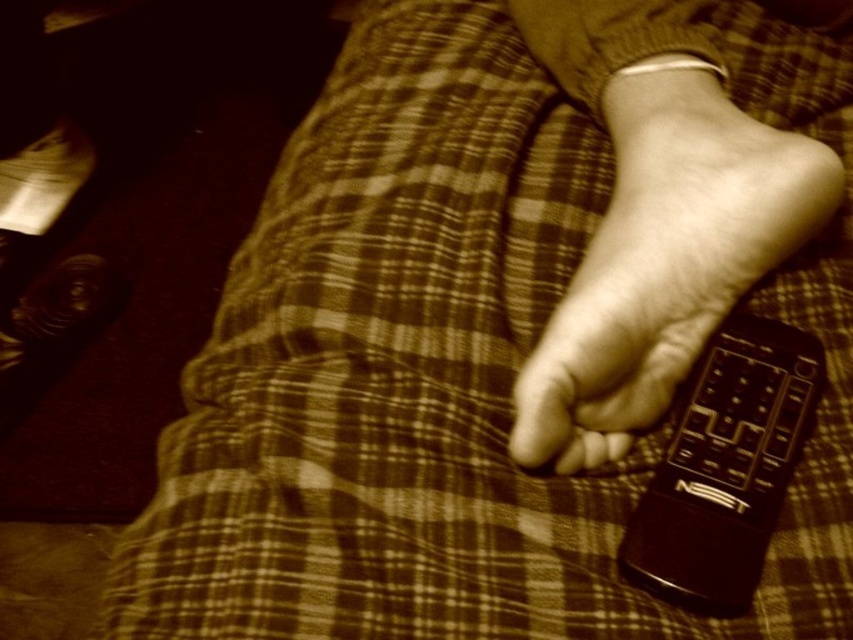
Question: Is matte black remote at lower right above black plastic remote at lower right?

Choices:
 (A) no
 (B) yes

Answer: (B)

Question: Is matte black remote at lower right below black plastic remote at lower right?

Choices:
 (A) no
 (B) yes

Answer: (A)

Question: Among these objects, which one is nearest to the camera?

Choices:
 (A) matte black remote at lower right
 (B) black plastic remote at lower right

Answer: (B)

Question: Which object is closer to the camera taking this photo?

Choices:
 (A) black plastic remote at lower right
 (B) matte black remote at lower right

Answer: (A)

Question: Observing the image, what is the correct spatial positioning of matte black remote at lower right in reference to black plastic remote at lower right?

Choices:
 (A) below
 (B) above

Answer: (B)